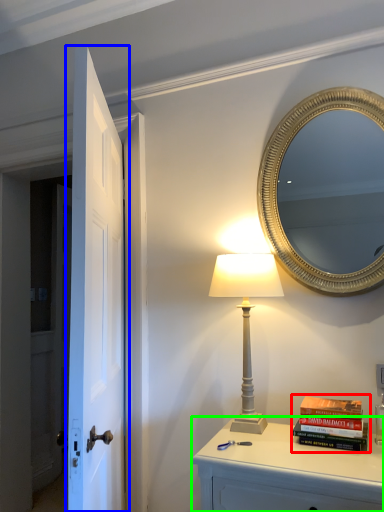
Question: Which is farther away from book (highlighted by a red box)? door (highlighted by a blue box) or nightstand (highlighted by a green box)?

Choices:
 (A) door
 (B) nightstand

Answer: (A)